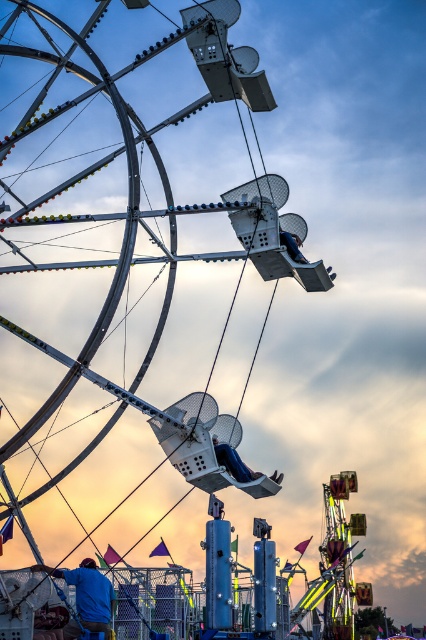
Question: Which point is closer to the camera?

Choices:
 (A) (287, 224)
 (B) (291, 237)

Answer: (B)

Question: Which of these objects is positioned farthest from the blue fabric at lower left?

Choices:
 (A) blue fabric seat at center
 (B) metallic silver ferris wheel at center

Answer: (B)

Question: Based on their relative distances, which object is nearer to the metallic silver ferris wheel at center?

Choices:
 (A) blue fabric seat at upper center
 (B) blue fabric seat at center
 (C) blue fabric at lower left

Answer: (A)

Question: Does metallic silver ferris wheel at center appear on the left side of blue fabric seat at upper center?

Choices:
 (A) yes
 (B) no

Answer: (A)

Question: Can you confirm if metallic silver ferris wheel at center is positioned to the left of blue fabric seat at upper center?

Choices:
 (A) no
 (B) yes

Answer: (B)

Question: Can you confirm if blue fabric at lower left is thinner than metallic silver ferris wheel at center?

Choices:
 (A) yes
 (B) no

Answer: (B)